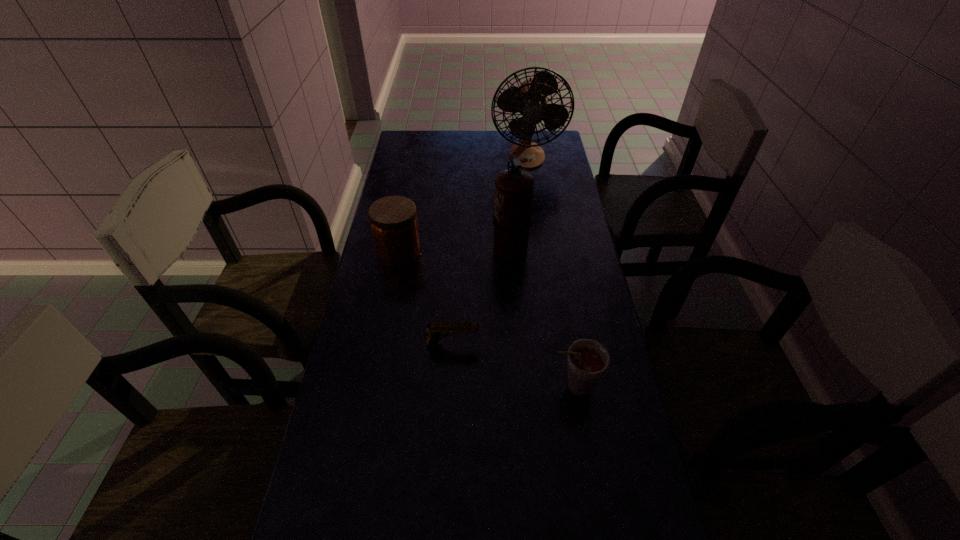
Where is `fan`? fan is located at coordinates (529, 99).

At what (x,y) coordinates should I click in order to perform the action: click on fire extinguisher. Please return your answer as a coordinate pair (x, y). This screenshot has width=960, height=540. Looking at the image, I should click on (512, 218).

Identify the location of the nearest object. (587, 361).

You are a GUI agent. You are given a task and a screenshot of the screen. Output one action in this format:
    pyautogui.click(x=<x>, y=<y>)
    Task: Click on the leftmost object
    This screenshot has height=540, width=960.
    Given the screenshot: What is the action you would take?
    pyautogui.click(x=393, y=220)

Locate an element on the screen. the shortest object is located at coordinates (437, 330).

This screenshot has height=540, width=960. Identify the location of the second object from left to right. (437, 330).

The height and width of the screenshot is (540, 960). I want to click on vacant space located in front of the farthest object to direct airflow, so click(534, 205).

This screenshot has width=960, height=540. What are the coordinates of `vacant space situated toward the nozzle of the fire extinguisher` in the screenshot? It's located at (474, 247).

Locate an element on the screen. vacant area located 0.180m toward the nozzle of the fire extinguisher is located at coordinates (439, 247).

This screenshot has height=540, width=960. I want to click on vacant region located 0.060m toward the nozzle of the fire extinguisher, so click(474, 247).